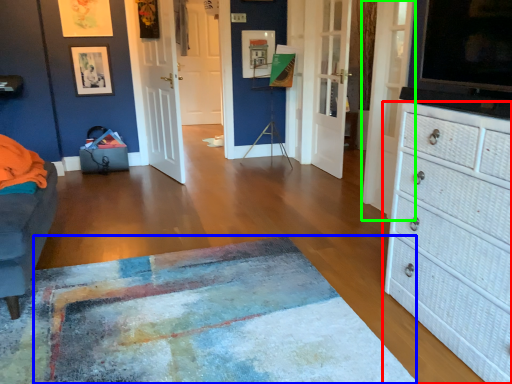
Question: Estimate the real-world distances between objects in this image. Which object is farther from chest of drawers (highlighted by a red box), mat (highlighted by a blue box) or door (highlighted by a green box)?

Choices:
 (A) mat
 (B) door

Answer: (B)